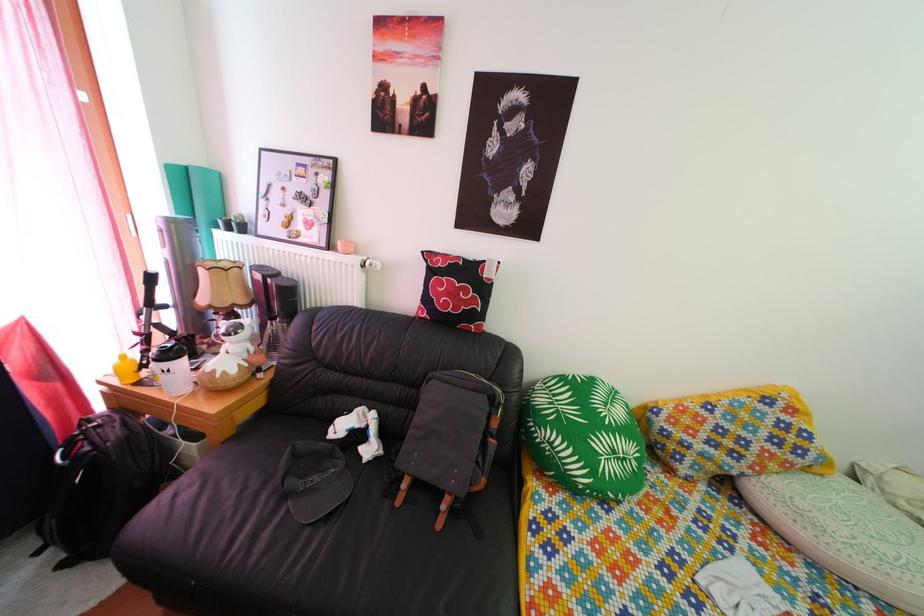
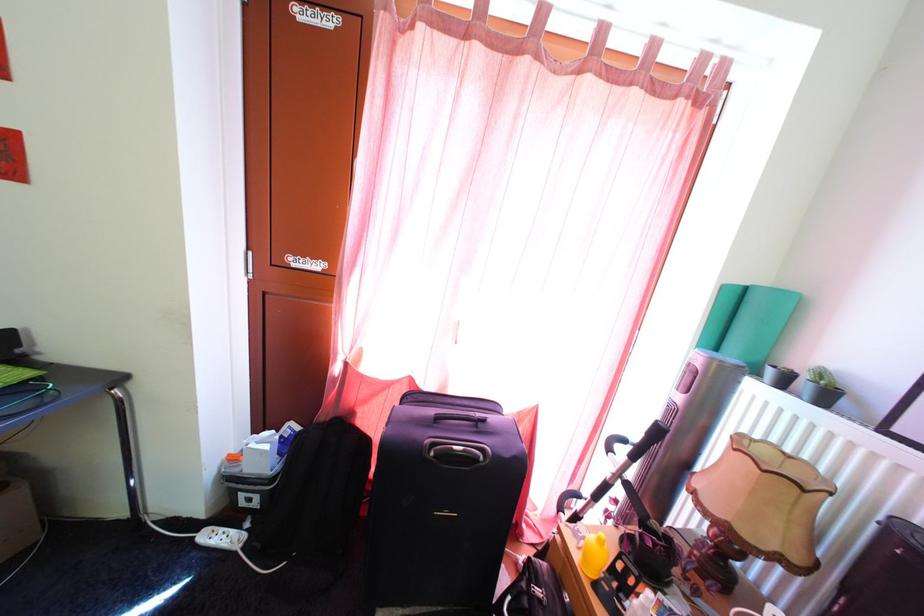
Question: The first image is from the beginning of the video and the second image is from the end. How did the camera likely rotate when shooting the video?

Choices:
 (A) Left
 (B) Right
 (C) Up
 (D) Down

Answer: (A)